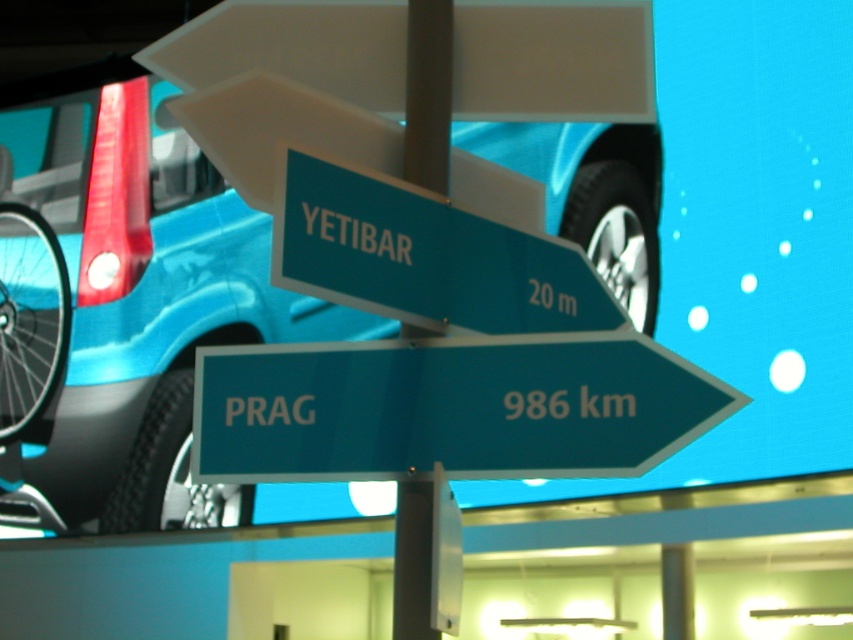
Is point (572, 522) less distant than point (283, 241)?

No, it is behind (283, 241).

How much distance is there between white glossy sign at center and teal plastic sign at center?

The distance of white glossy sign at center from teal plastic sign at center is 8.07 meters.

Does point (689, 525) lie behind point (474, 326)?

Yes, point (689, 525) is behind point (474, 326).

Locate an element on the screen. white glossy sign at center is located at coordinates (660, 557).

Looking at this image, between metallic blue car at center and white glossy sign at center, which one is positioned lower?

white glossy sign at center is lower down.

Is metallic blue car at center further to camera compared to white glossy sign at center?

No, it is not.

What do you see at coordinates (137, 298) in the screenshot? The height and width of the screenshot is (640, 853). I see `metallic blue car at center` at bounding box center [137, 298].

At what (x,y) coordinates should I click in order to perform the action: click on metallic blue car at center. Please return your answer as a coordinate pair (x, y). Looking at the image, I should click on (137, 298).

Does metallic blue car at center have a larger size compared to metallic pole at center?

Correct, metallic blue car at center is larger in size than metallic pole at center.

Consider the image. Is metallic blue car at center below metallic pole at center?

Correct, metallic blue car at center is located below metallic pole at center.

The width and height of the screenshot is (853, 640). Describe the element at coordinates (137, 298) in the screenshot. I see `metallic blue car at center` at that location.

In order to click on metallic blue car at center in this screenshot , I will do `click(137, 298)`.